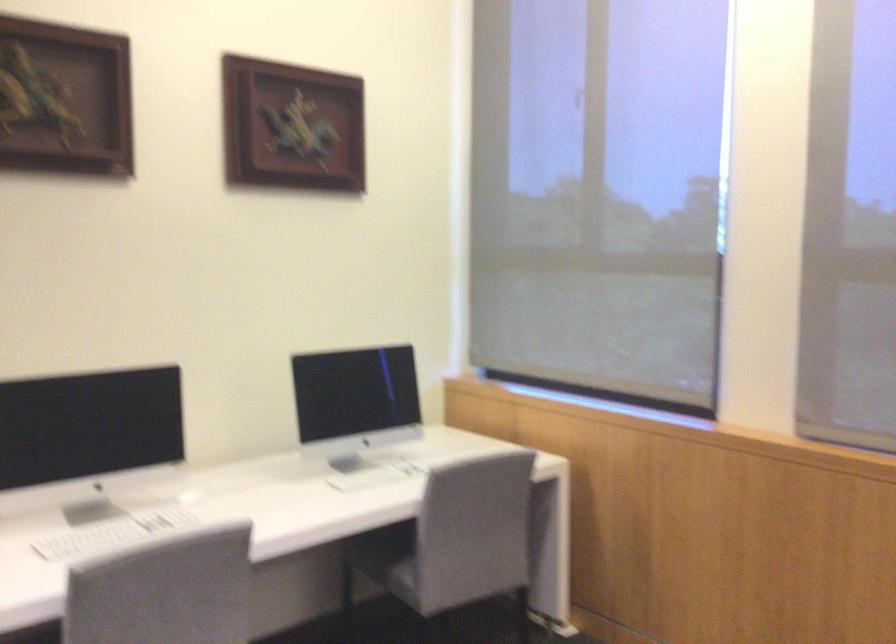
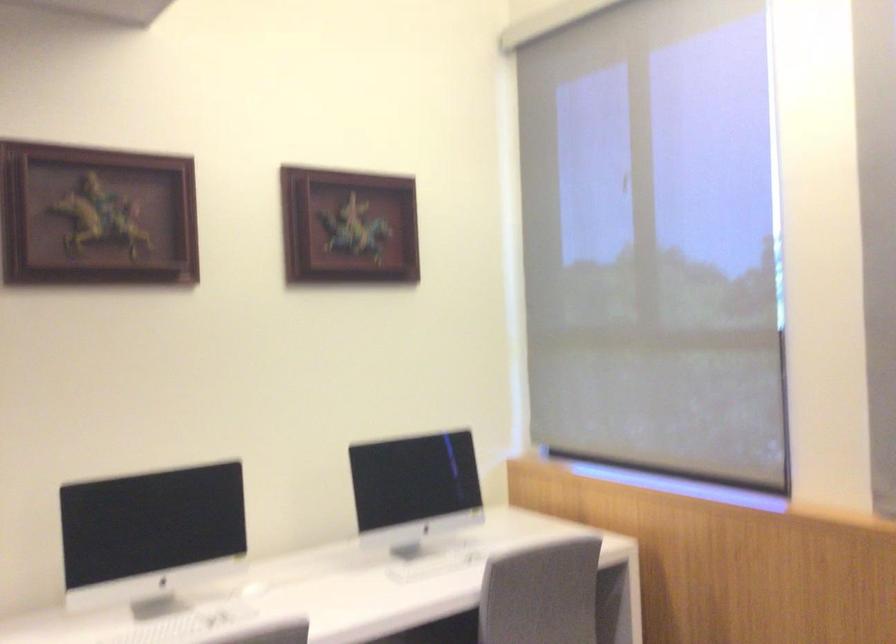
Question: Which direction would the cameraman need to move to produce the second image? Reply with the corresponding letter.

Choices:
 (A) Left
 (B) Right
 (C) Forward
 (D) Backward

Answer: (B)